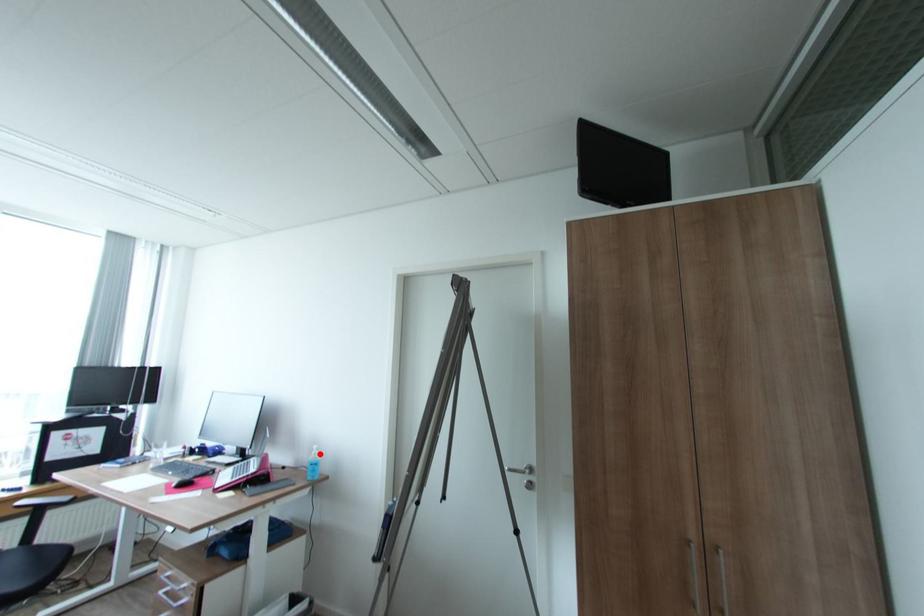
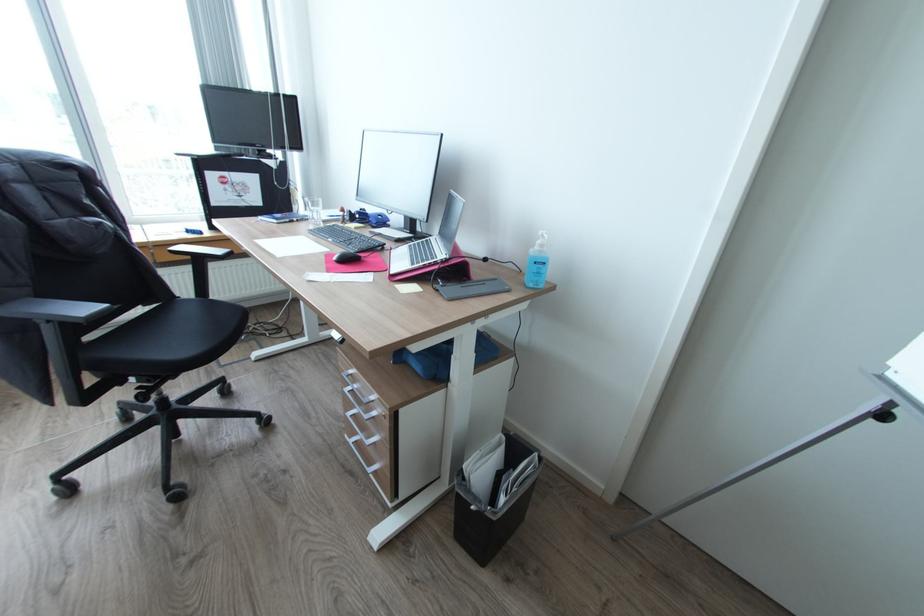
Locate, in the second image, the point that corresponds to the highlighted location in the first image.

(545, 245)